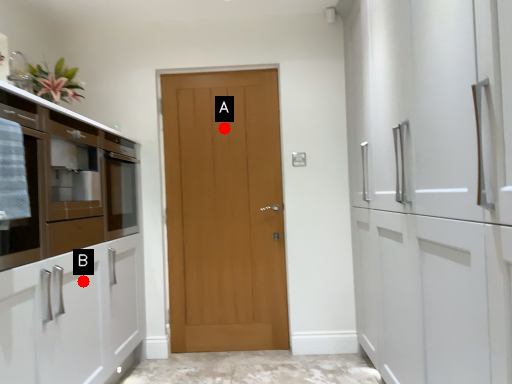
Question: Two points are circled on the image, labeled by A and B beside each circle. Among these points, which one is farthest from the camera?

Choices:
 (A) A is further
 (B) B is further

Answer: (A)